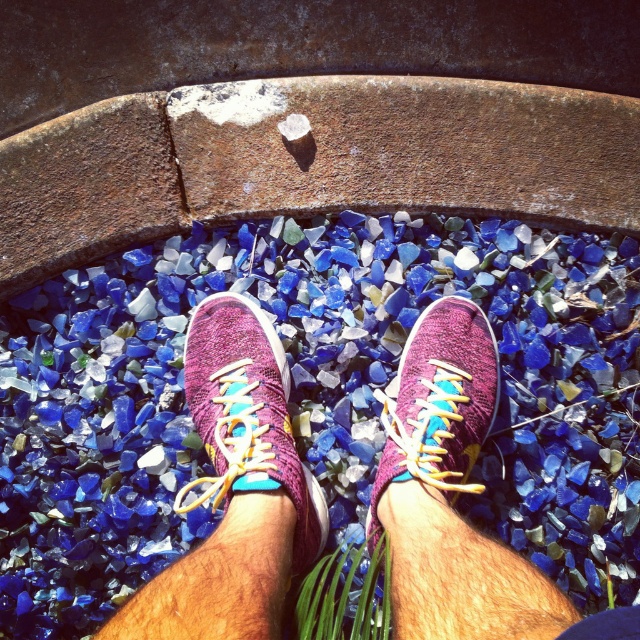
Is pink knitted sneakers at center thinner than knitted purple shoe at center?

No, pink knitted sneakers at center is not thinner than knitted purple shoe at center.

What do you see at coordinates (234, 490) in the screenshot? The height and width of the screenshot is (640, 640). I see `pink knitted sneakers at center` at bounding box center [234, 490].

Is point (480, 368) farther from viewer compared to point (298, 483)?

Yes, it is behind point (298, 483).

Where is `pink knitted sneakers at center`? The width and height of the screenshot is (640, 640). pink knitted sneakers at center is located at coordinates (234, 490).

In the scene shown: Who is more forward, (304,483) or (452,474)?

Positioned in front is point (452,474).

Which of these two, pink knitted sneakers at center or knit fabric sneaker at center, stands shorter?

Standing shorter between the two is knit fabric sneaker at center.

Between point (275, 333) and point (474, 456), which one is positioned behind?

The point (275, 333) is more distant.

Identify the location of pink knitted sneakers at center. (234, 490).

Does knitted purple shoe at center have a greater height compared to knit fabric sneaker at center?

Indeed, knitted purple shoe at center has a greater height compared to knit fabric sneaker at center.

Who is taller, knitted purple shoe at center or knit fabric sneaker at center?

knitted purple shoe at center

Find the location of a particular element. The height and width of the screenshot is (640, 640). knitted purple shoe at center is located at coordinates click(246, 416).

The height and width of the screenshot is (640, 640). Find the location of `knitted purple shoe at center`. knitted purple shoe at center is located at coordinates (246, 416).